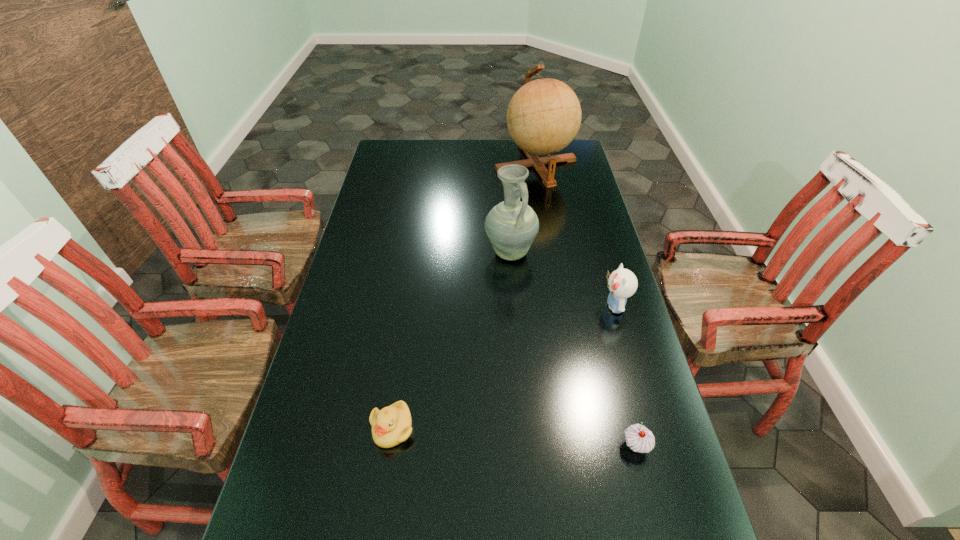
The image size is (960, 540). Find the location of `object that is at the far right corner`. object that is at the far right corner is located at coordinates (543, 117).

In the image, there is a desktop. At what (x,y) coordinates should I click in order to perform the action: click on free space at the far edge. Please return your answer as a coordinate pair (x, y). The width and height of the screenshot is (960, 540). Looking at the image, I should click on (446, 150).

The height and width of the screenshot is (540, 960). In the image, there is a desktop. Identify the location of vacant space at the left edge. (388, 259).

In the image, there is a desktop. Where is `vacant space at the right edge`? This screenshot has height=540, width=960. vacant space at the right edge is located at coordinates (562, 181).

Where is `vacant area at the far left corner of the desktop`? The width and height of the screenshot is (960, 540). vacant area at the far left corner of the desktop is located at coordinates (412, 144).

At what (x,y) coordinates should I click in order to perform the action: click on vacant space that's between the cupcake and the kitten. Please return your answer as a coordinate pair (x, y). This screenshot has height=540, width=960. Looking at the image, I should click on (625, 376).

Find the location of a particular element. The width and height of the screenshot is (960, 540). free area in between the duckling and the kitten is located at coordinates (503, 367).

At what (x,y) coordinates should I click in order to perform the action: click on unoccupied area between the kitten and the second shortest object. Please return your answer as a coordinate pair (x, y). The height and width of the screenshot is (540, 960). Looking at the image, I should click on (625, 376).

Locate an element on the screen. The image size is (960, 540). vacant area that lies between the leftmost object and the third farthest object is located at coordinates (503, 367).

In order to click on free space between the cupcake and the third tallest object in this screenshot , I will do `click(625, 376)`.